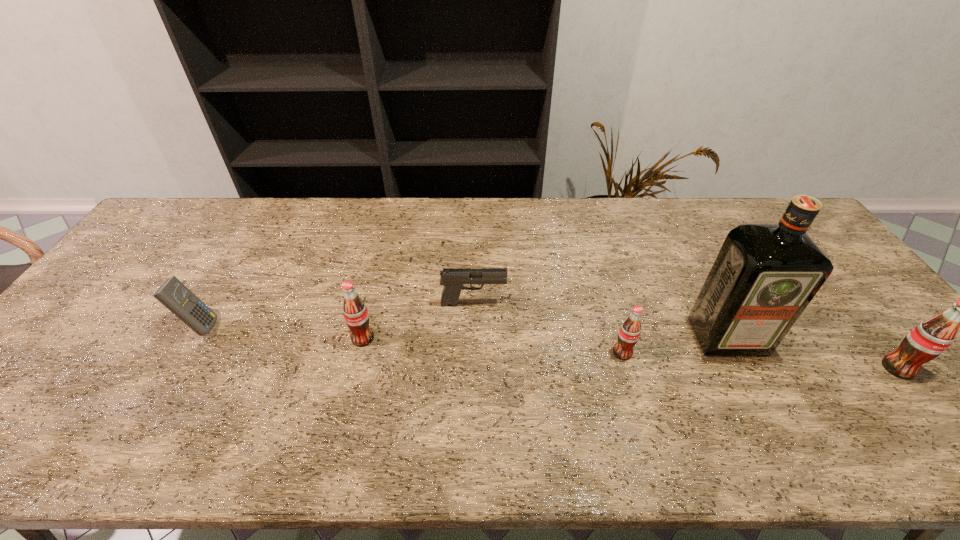
At what (x,y) coordinates should I click in order to perform the action: click on object identified as the third closest to the tallest object. Please return your answer as a coordinate pair (x, y). This screenshot has height=540, width=960. Looking at the image, I should click on (452, 279).

Identify which object is the fifth nearest to the pistol. Please provide its 2D coordinates. Your answer should be formatted as a tuple, i.e. [(x, y)], where the tuple contains the x and y coordinates of a point satisfying the conditions above.

[(929, 339)]

Identify which soda is located as the third nearest to the calculator. Please provide its 2D coordinates. Your answer should be formatted as a tuple, i.e. [(x, y)], where the tuple contains the x and y coordinates of a point satisfying the conditions above.

[(929, 339)]

Select which soda appears as the second closest to the fifth object from right to left. Please provide its 2D coordinates. Your answer should be formatted as a tuple, i.e. [(x, y)], where the tuple contains the x and y coordinates of a point satisfying the conditions above.

[(929, 339)]

The image size is (960, 540). What are the coordinates of `vacant area that satisfies the following two spatial constraints: 1. on the front label of the rightmost soda; 2. on the left side of the fifth object from left to right` in the screenshot? It's located at (743, 368).

The width and height of the screenshot is (960, 540). In order to click on free region that satisfies the following two spatial constraints: 1. aim along the barrel of the pistol; 2. on the left side of the rightmost soda in this screenshot , I will do `click(472, 368)`.

This screenshot has width=960, height=540. I want to click on vacant area in the image that satisfies the following two spatial constraints: 1. on the front-facing side of the shortest soda; 2. on the left side of the leftmost object, so click(x=184, y=353).